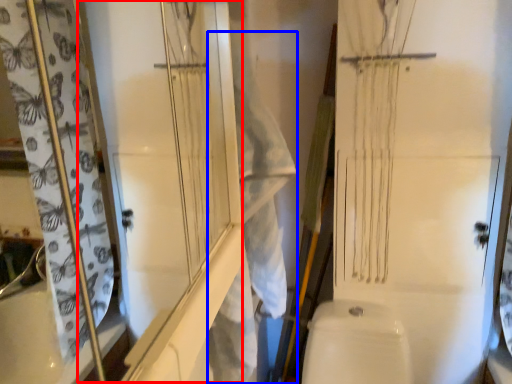
Question: Which object is further to the camera taking this photo, screen door (highlighted by a red box) or laundry (highlighted by a blue box)?

Choices:
 (A) screen door
 (B) laundry

Answer: (B)